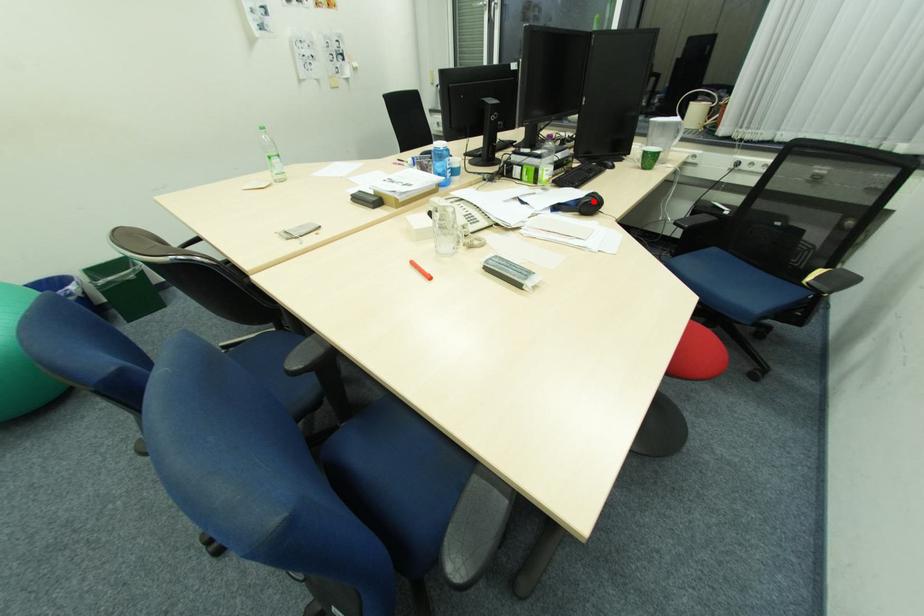
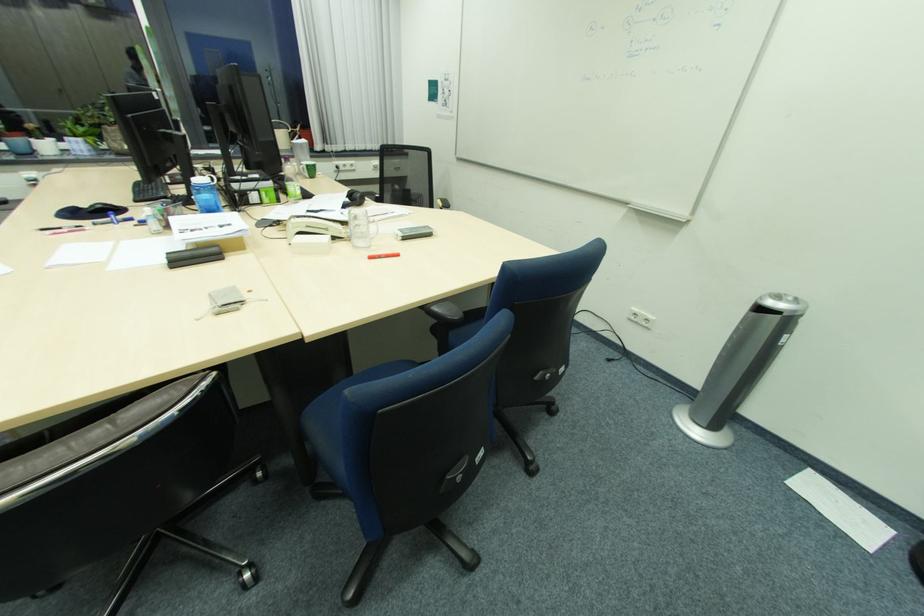
Locate, in the second image, the point that corresponds to the highlighted location in the first image.

(365, 195)